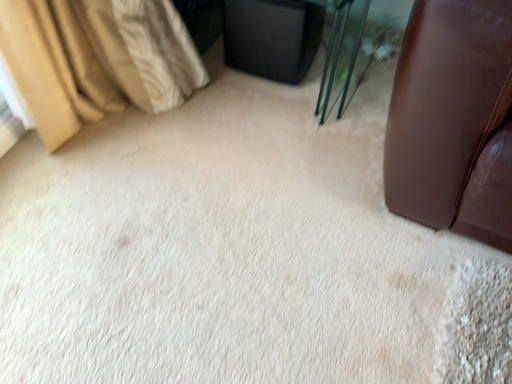
At what (x,y) coordinates should I click in order to perform the action: click on black plastic table at upper center. Please return your answer as a coordinate pair (x, y). Looking at the image, I should click on (x=343, y=58).

In order to face black plastic table at upper center, should I rotate leftwards or rightwards?

Turn right approximately 3.666 degrees to face it.

What do you see at coordinates (343, 58) in the screenshot?
I see `black plastic table at upper center` at bounding box center [343, 58].

You are a GUI agent. You are given a task and a screenshot of the screen. Output one action in this format:
    pyautogui.click(x=<x>, y=<y>)
    Task: Click on the black plastic table at upper center
    
    Given the screenshot: What is the action you would take?
    pyautogui.click(x=343, y=58)